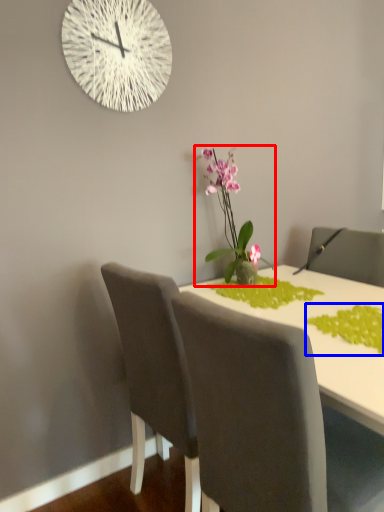
Question: Which of the following is the closest to the observer, houseplant (highlighted by a red box) or plant (highlighted by a blue box)?

Choices:
 (A) houseplant
 (B) plant

Answer: (B)